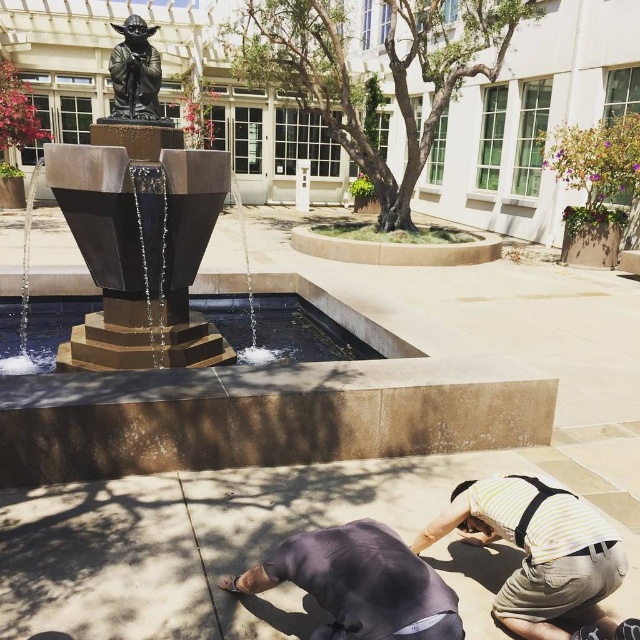
Question: Does yellow striped shirt at lower right appear under bronze statue at center?

Choices:
 (A) yes
 (B) no

Answer: (A)

Question: Where is dark gray fabric squat at lower center located in relation to bronze statue at center in the image?

Choices:
 (A) below
 (B) above

Answer: (A)

Question: Where is yellow striped shirt at lower right located in relation to dark gray fabric squat at lower center in the image?

Choices:
 (A) below
 (B) above

Answer: (A)

Question: Which point appears closest to the camera in this image?

Choices:
 (A) (145, 65)
 (B) (433, 605)

Answer: (B)

Question: Among these objects, which one is nearest to the camera?

Choices:
 (A) bronze statue at center
 (B) yellow striped shirt at lower right
 (C) dark gray fabric squat at lower center

Answer: (C)

Question: Which point appears closest to the camera in this image?

Choices:
 (A) (420, 531)
 (B) (113, 77)

Answer: (A)